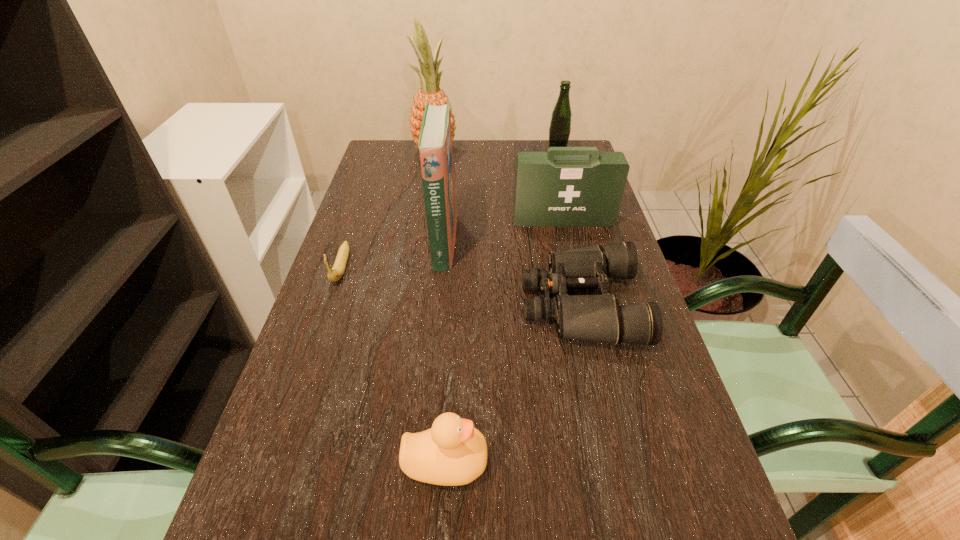
The width and height of the screenshot is (960, 540). Identify the location of pineapple. (430, 91).

Locate an element on the screen. The height and width of the screenshot is (540, 960). the sixth shortest object is located at coordinates (435, 139).

The image size is (960, 540). Find the location of `the fifth shortest object`. the fifth shortest object is located at coordinates (560, 126).

Where is `the first-aid kit`? the first-aid kit is located at coordinates (566, 186).

Find the location of a particular element. duck is located at coordinates tap(451, 453).

At what (x,y) coordinates should I click in order to perform the action: click on the nearest object. Please return your answer as a coordinate pair (x, y). Looking at the image, I should click on (451, 453).

The width and height of the screenshot is (960, 540). Find the location of `banana`. banana is located at coordinates (337, 271).

You are a GUI agent. You are given a task and a screenshot of the screen. Output one action in this format:
    pyautogui.click(x=<x>, y=<y>)
    Task: Click on the binoculars
    
    Given the screenshot: What is the action you would take?
    pyautogui.click(x=599, y=318)

Locate an element on the screen. The width and height of the screenshot is (960, 540). free space located on the front of the pineapple is located at coordinates (421, 240).

Identify the location of free space located on the cover of the hardback book. The width and height of the screenshot is (960, 540). (593, 241).